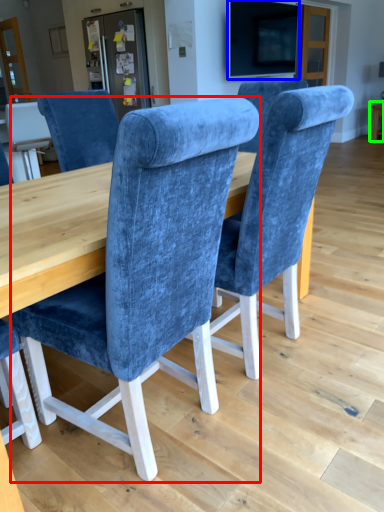
Question: Which object is positioned closest to chair (highlighted by a red box)? Select from television (highlighted by a blue box) and table (highlighted by a green box).

Choices:
 (A) television
 (B) table

Answer: (A)